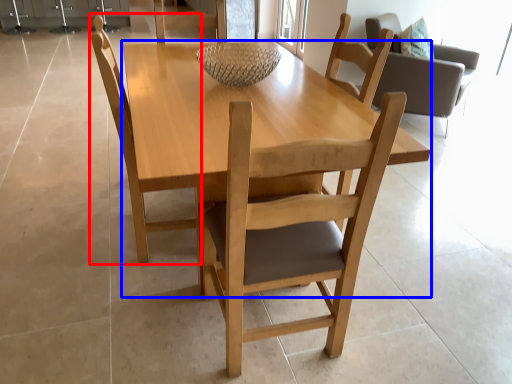
Question: Which point is further to the camera, chair (highlighted by a red box) or round table (highlighted by a blue box)?

Choices:
 (A) chair
 (B) round table

Answer: (A)